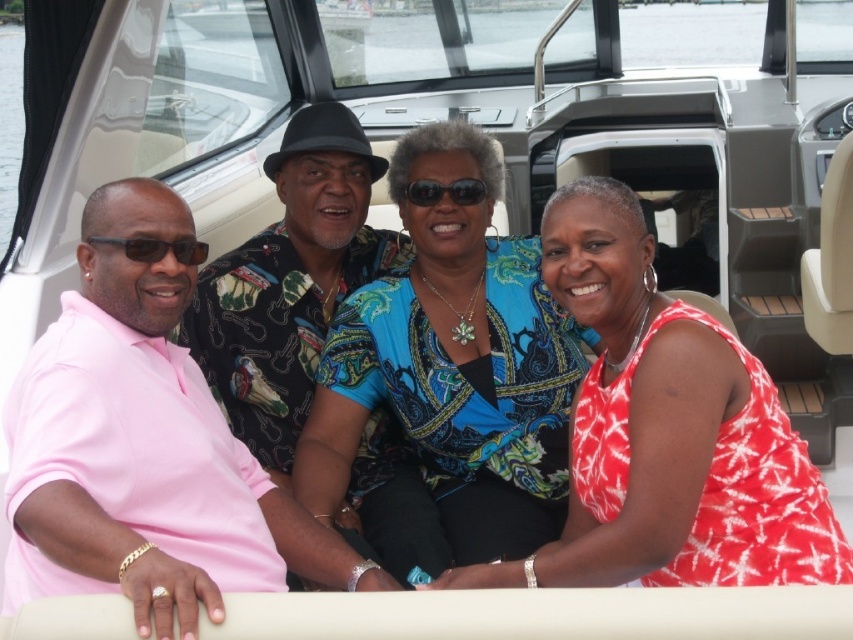
Question: Considering the real-world distances, which object is closest to the blue paisley blouse at center?

Choices:
 (A) pink cotton polo shirt at left
 (B) printed fabric shirt at center
 (C) matte black sunglasses at left

Answer: (B)

Question: Observing the image, what is the correct spatial positioning of printed cotton dress at center in reference to black plastic sunglasses at center?

Choices:
 (A) left
 (B) right

Answer: (B)

Question: Which object appears farthest from the camera in this image?

Choices:
 (A) matte black sunglasses at left
 (B) printed fabric shirt at center

Answer: (B)

Question: Can you confirm if printed fabric shirt at center is bigger than black plastic sunglasses at center?

Choices:
 (A) no
 (B) yes

Answer: (B)

Question: Is printed fabric shirt at center to the left of matte black sunglasses at left from the viewer's perspective?

Choices:
 (A) no
 (B) yes

Answer: (A)

Question: Which object is the closest to the printed fabric shirt at center?

Choices:
 (A) printed cotton dress at center
 (B) matte black sunglasses at left

Answer: (B)